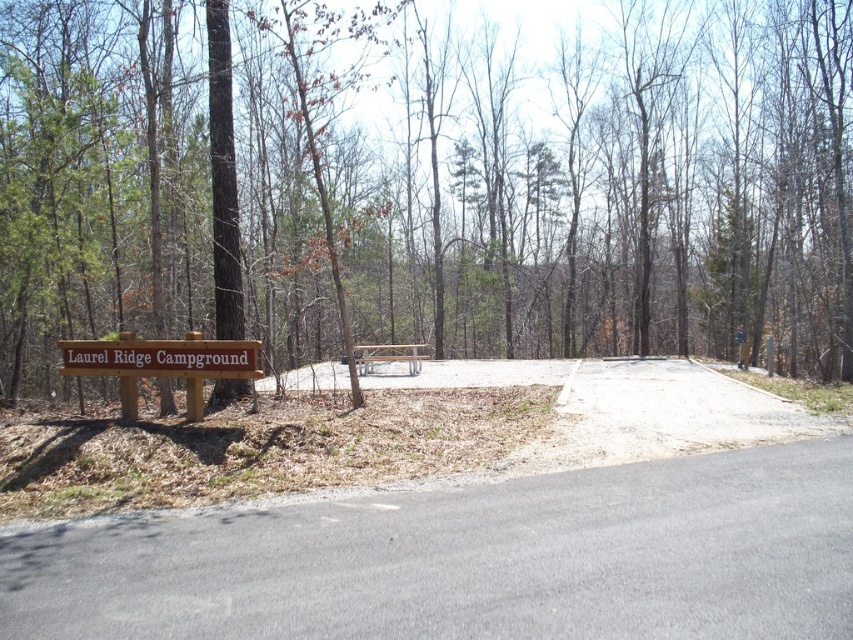
This screenshot has height=640, width=853. Find the location of `brown wood sign at left`. brown wood sign at left is located at coordinates (427, 182).

Image resolution: width=853 pixels, height=640 pixels. Identify the location of brown wood sign at left. (427, 182).

Is brown wood sign at left below brown wooden sign at lower left?

No, brown wood sign at left is not below brown wooden sign at lower left.

Can you confirm if brown wood sign at left is smaller than brown wooden sign at lower left?

No, brown wood sign at left is not smaller than brown wooden sign at lower left.

Who is more distant from viewer, (538,252) or (142,339)?

The point (538,252) is more distant.

Identify the location of brown wood sign at left. The height and width of the screenshot is (640, 853). (427, 182).

Is brown wood sign at left smaller than brown wooden sign at center?

No.

Identify the location of brown wood sign at left. This screenshot has height=640, width=853. (427, 182).